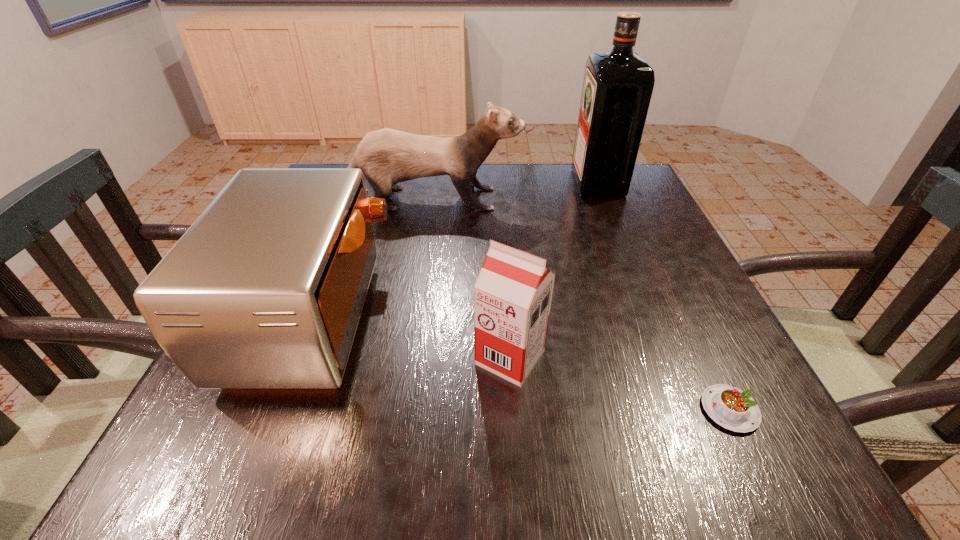
Where is `empty location between the tallest object and the soya milk`? empty location between the tallest object and the soya milk is located at coordinates (554, 270).

Find the location of `vacant space that is in between the pudding and the ferret`. vacant space that is in between the pudding and the ferret is located at coordinates (572, 305).

Image resolution: width=960 pixels, height=540 pixels. I want to click on free point between the shortest object and the liquor, so click(663, 296).

Locate an element on the screen. free point between the liquor and the ferret is located at coordinates (507, 191).

This screenshot has width=960, height=540. I want to click on vacant space in between the soya milk and the shortest object, so click(x=620, y=383).

Locate an element on the screen. vacant point located between the liquor and the soya milk is located at coordinates (554, 270).

You are a GUI agent. You are given a task and a screenshot of the screen. Output one action in this format:
    pyautogui.click(x=<x>, y=<y>)
    Task: Click on the closest object relative to the soya milk
    This screenshot has height=540, width=960.
    Given the screenshot: What is the action you would take?
    pyautogui.click(x=265, y=290)

You are a GUI agent. You are given a task and a screenshot of the screen. Output one action in this format:
    pyautogui.click(x=<x>, y=<y>)
    Task: Click on the object identified as the closest to the soya milk
    This screenshot has height=540, width=960.
    Given the screenshot: What is the action you would take?
    pyautogui.click(x=265, y=290)

Find the location of `vacant area that satisfies the following two spatial constraints: 1. on the back side of the soya milk; 2. on the face of the ferret`. vacant area that satisfies the following two spatial constraints: 1. on the back side of the soya milk; 2. on the face of the ferret is located at coordinates (500, 199).

Identify the location of vacant space that satisfies the following two spatial constraints: 1. on the door side of the toaster oven; 2. on the right side of the shortest object. (279, 410).